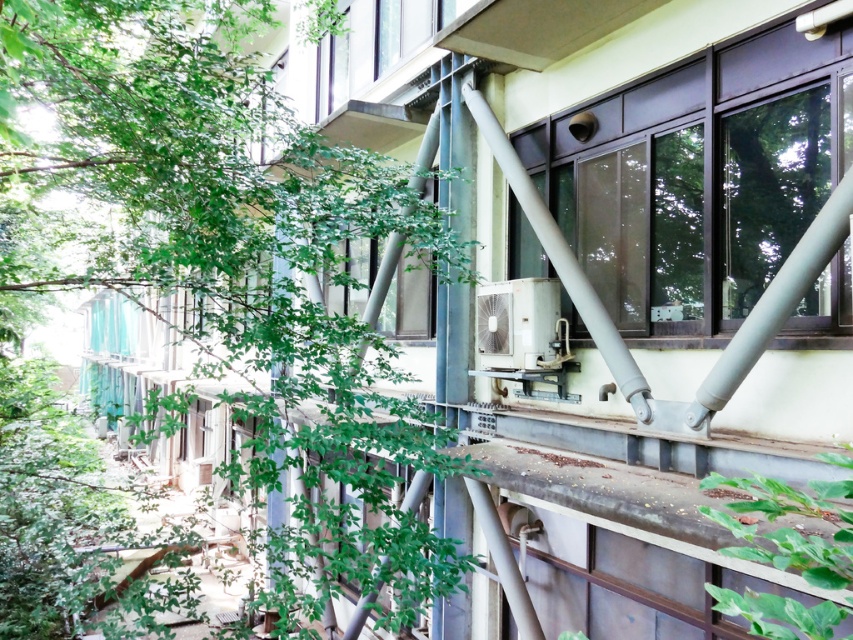
Does green leafy tree at upper left appear on the right side of clear glass window at center?

No, green leafy tree at upper left is not to the right of clear glass window at center.

Is green leafy tree at upper left closer to camera compared to clear glass window at center?

Yes.

Is point (334, 362) farther from camera compared to point (397, 234)?

No, it is in front of (397, 234).

Identify the location of green leafy tree at upper left. (221, 246).

Is green leafy tree at upper left thinner than metallic gray window at upper right?

Correct, green leafy tree at upper left's width is less than metallic gray window at upper right's.

Describe the element at coordinates (221, 246) in the screenshot. I see `green leafy tree at upper left` at that location.

At what (x,y) coordinates should I click in order to perform the action: click on green leafy tree at upper left. Please return your answer as a coordinate pair (x, y). This screenshot has height=640, width=853. Looking at the image, I should click on (221, 246).

Which is more to the left, metallic gray window at upper right or clear glass window at center?

clear glass window at center

Does metallic gray window at upper right appear on the right side of clear glass window at center?

Yes, metallic gray window at upper right is to the right of clear glass window at center.

The image size is (853, 640). What do you see at coordinates (700, 176) in the screenshot?
I see `metallic gray window at upper right` at bounding box center [700, 176].

Identify the location of metallic gray window at upper right. The width and height of the screenshot is (853, 640). (700, 176).